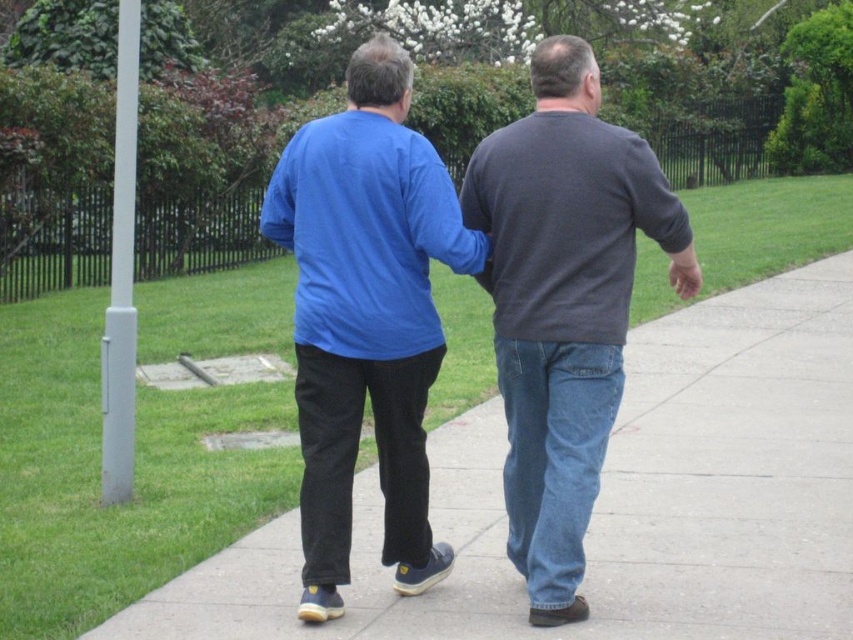
Question: Considering the real-world distances, which object is closest to the blue matte shirt at center?

Choices:
 (A) concrete sidewalk at center
 (B) dark gray sweater at center

Answer: (B)

Question: Which object is closer to the camera taking this photo?

Choices:
 (A) dark gray sweater at center
 (B) blue matte shirt at center

Answer: (A)

Question: Is blue matte shirt at center positioned before dark gray sweater at center?

Choices:
 (A) yes
 (B) no

Answer: (B)

Question: Which of the following is the farthest from the observer?

Choices:
 (A) (416, 461)
 (B) (796, 394)

Answer: (B)

Question: Is blue matte shirt at center bigger than dark gray sweater at center?

Choices:
 (A) no
 (B) yes

Answer: (A)

Question: Is concrete sidewalk at center to the left of blue matte shirt at center from the viewer's perspective?

Choices:
 (A) no
 (B) yes

Answer: (A)